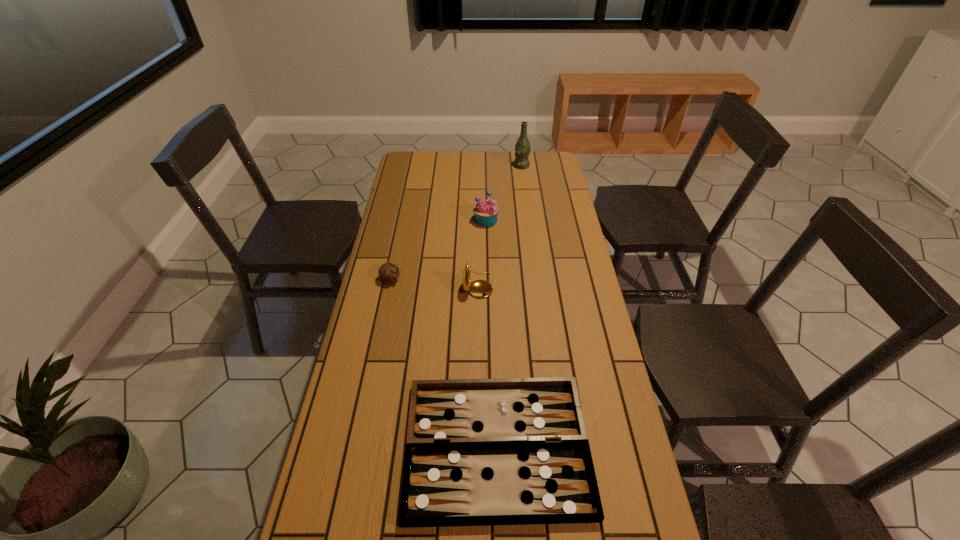
Image resolution: width=960 pixels, height=540 pixels. Find the location of `object that is positioned at the far right corner`. object that is positioned at the far right corner is located at coordinates (523, 147).

Identify the location of free region at the far edge of the desktop. (513, 172).

At what (x,y) coordinates should I click in order to perform the action: click on vacant space at the left edge of the desktop. Please return your answer as a coordinate pair (x, y). Image resolution: width=960 pixels, height=540 pixels. Looking at the image, I should click on (414, 185).

Locate an element on the screen. vacant space at the right edge of the desktop is located at coordinates (550, 304).

In the image, there is a desktop. Identify the location of vacant space at the far right corner. This screenshot has height=540, width=960. point(562,168).

This screenshot has height=540, width=960. In order to click on free space between the shortest object and the farther muffin in this screenshot , I will do `click(492, 333)`.

This screenshot has height=540, width=960. I want to click on free space that is in between the beer bottle and the right muffin, so click(x=504, y=193).

Find the location of `free space between the nearest object and the right muffin`. free space between the nearest object and the right muffin is located at coordinates (492, 333).

The height and width of the screenshot is (540, 960). I want to click on free spot between the second shortest object and the taller muffin, so click(439, 249).

The height and width of the screenshot is (540, 960). What are the coordinates of `empty space between the pocket watch and the shortest object` in the screenshot? It's located at (487, 366).